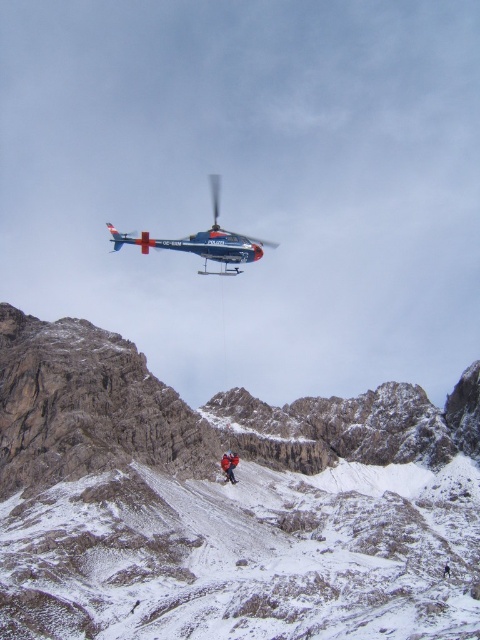
Is polished metallic helicopter at upper center wider than red fabric jacket at center?

Yes.

Identify the location of polished metallic helicopter at upper center. (204, 241).

Is point (243, 236) positioned behind point (223, 460)?

Yes, point (243, 236) is farther from viewer.

In order to click on polished metallic helicopter at upper center in this screenshot , I will do coord(204,241).

Which is above, snowy rocky mountain at center or red fabric jacket at center?

snowy rocky mountain at center is above.

Which is below, snowy rocky mountain at center or red fabric jacket at center?

red fabric jacket at center is below.

You are a GUI agent. You are given a task and a screenshot of the screen. Output one action in this format:
    pyautogui.click(x=<x>, y=<y>)
    Task: Click on the snowy rocky mountain at center
    This screenshot has width=480, height=640.
    Given the screenshot: What is the action you would take?
    pyautogui.click(x=226, y=502)

Which is behind, point (274, 614) or point (271, 243)?

The point (271, 243) is more distant.

Is point (247, 470) positioned after point (217, 259)?

No, it is not.

Identify the location of snowy rocky mountain at center. Image resolution: width=480 pixels, height=640 pixels. [226, 502].